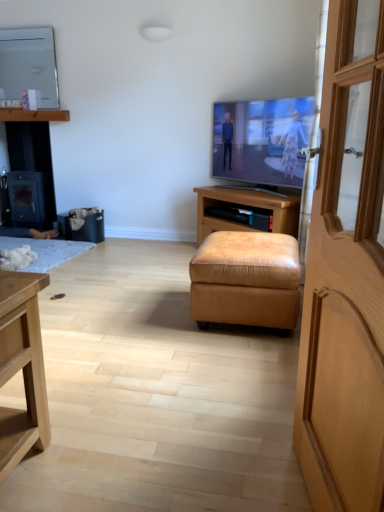
Find the location of a particular element. This screenshot has width=384, height=512. vacant space situated on the left part of tan leather ottoman at center is located at coordinates (145, 313).